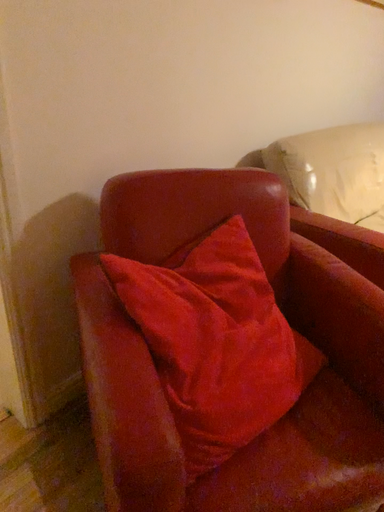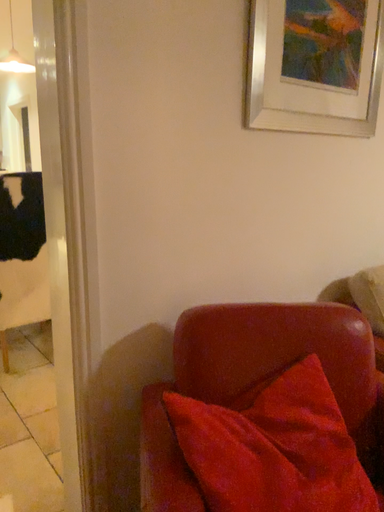
Question: How did the camera likely rotate when shooting the video?

Choices:
 (A) rotated upward
 (B) rotated downward

Answer: (A)